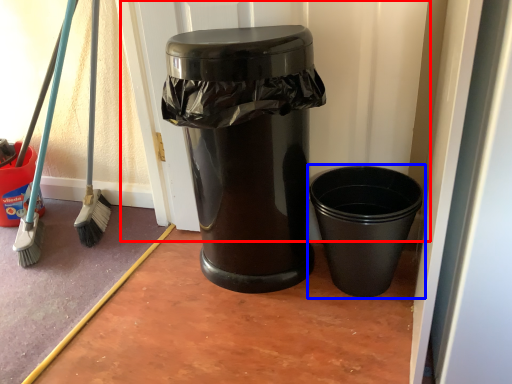
Question: Which point is further to the camera, screen door (highlighted by a red box) or waste container (highlighted by a blue box)?

Choices:
 (A) screen door
 (B) waste container

Answer: (A)